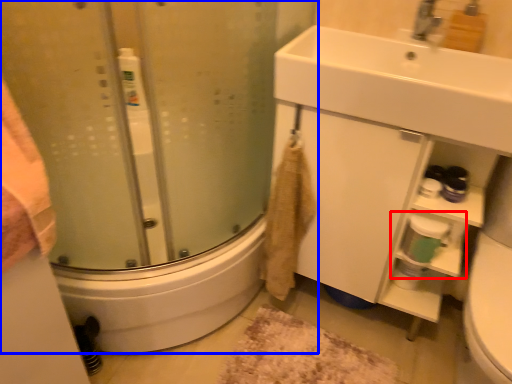
Question: Which point is further to the camera, shelf (highlighted by a red box) or shower door (highlighted by a blue box)?

Choices:
 (A) shelf
 (B) shower door

Answer: (A)